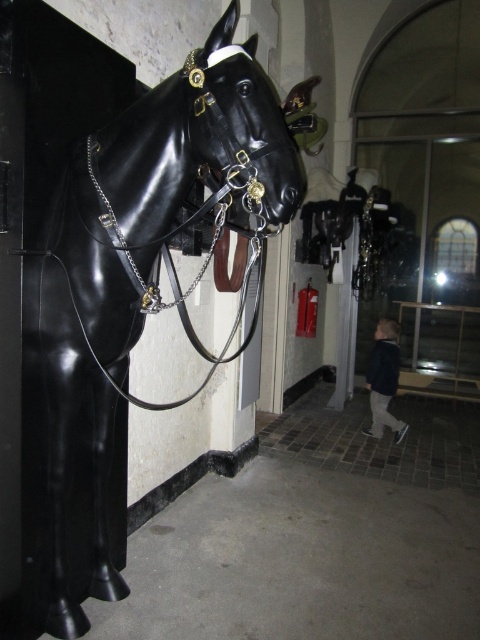
Question: Is black leather bridle at center positioned behind dark blue jacket at lower right?

Choices:
 (A) no
 (B) yes

Answer: (A)

Question: Which object appears closest to the camera in this image?

Choices:
 (A) glossy black horse head at center
 (B) glossy black horse at left
 (C) dark blue jacket at lower right
 (D) black leather bridle at center

Answer: (D)

Question: Is dark blue jacket at lower right closer to camera compared to glossy black horse head at center?

Choices:
 (A) yes
 (B) no

Answer: (A)

Question: Can you confirm if glossy black horse at left is positioned above dark blue jacket at lower right?

Choices:
 (A) no
 (B) yes

Answer: (B)

Question: Which point is farther from the camera taking this photo?

Choices:
 (A) (267, 92)
 (B) (398, 440)
 (C) (384, 337)

Answer: (C)

Question: Which object is farther from the camera taking this photo?

Choices:
 (A) glossy black horse at left
 (B) glossy black horse head at center
 (C) dark blue jacket at lower right
 (D) black leather bridle at center

Answer: (B)